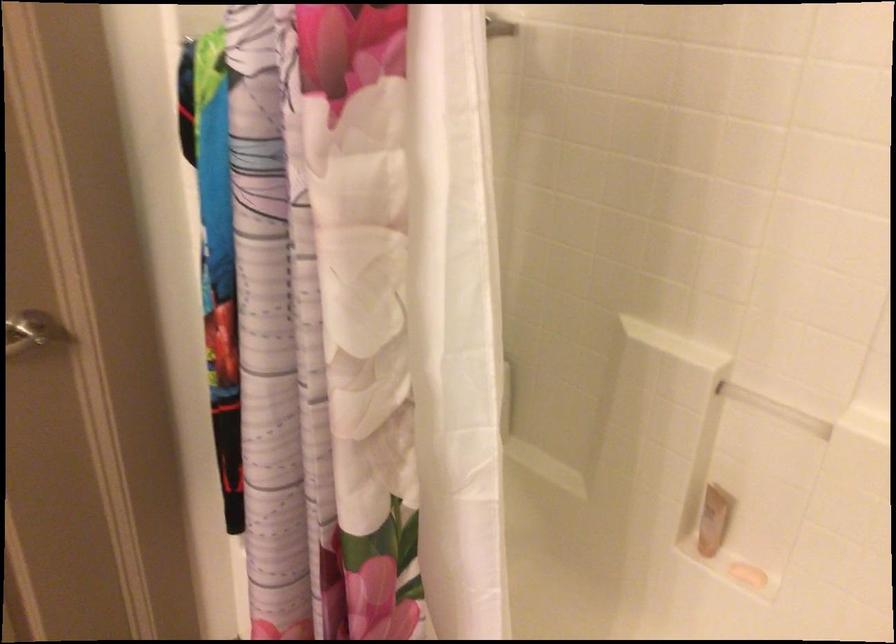
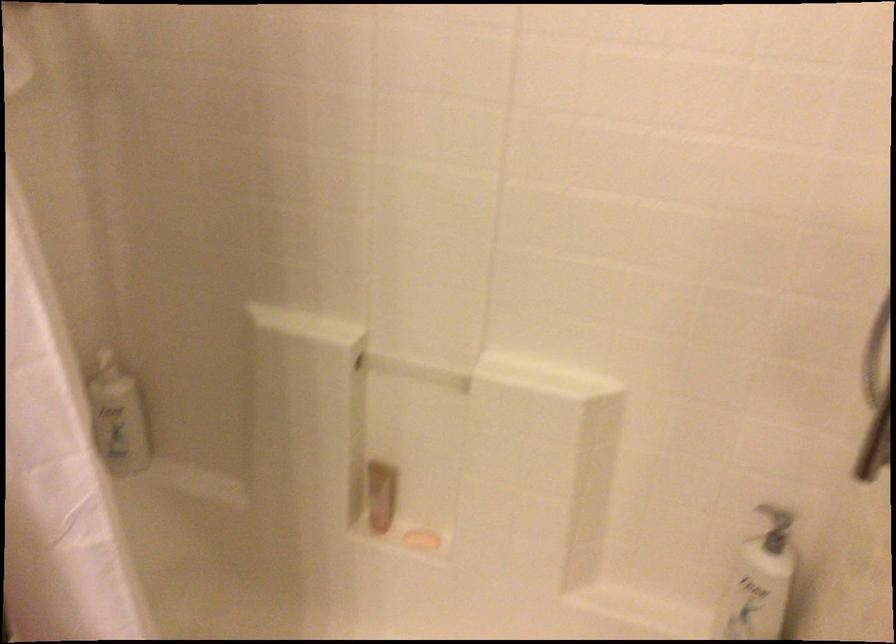
Locate, in the second image, the point that corresponds to [742,567] in the first image.

(421, 540)